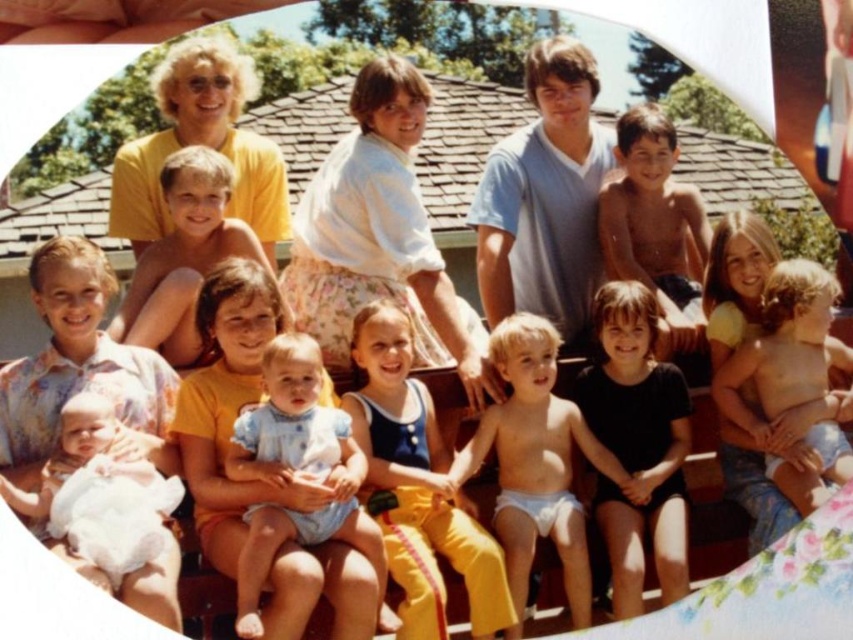
Question: Among these points, which one is farthest from the camera?

Choices:
 (A) (373, 545)
 (B) (804, 268)
 (C) (172, 282)
 (D) (619, 193)

Answer: (D)

Question: Which point is farther from the camera taking this photo?

Choices:
 (A) (207, 157)
 (B) (689, 336)
 (C) (306, 392)

Answer: (B)

Question: Is light blue diaper at center to the right of light blue fabric at center from the viewer's perspective?

Choices:
 (A) no
 (B) yes

Answer: (B)

Question: Does blue cotton tank top at center lie in front of white soft fabric baby at lower left?

Choices:
 (A) yes
 (B) no

Answer: (B)

Question: Among these points, which one is nearest to the camera?

Choices:
 (A) (402, 323)
 (B) (109, 474)
 (C) (657, 468)
 (D) (645, 234)

Answer: (B)

Question: Is black matte shirt at center wider than fluffy yellow pillow at upper right?

Choices:
 (A) no
 (B) yes

Answer: (A)